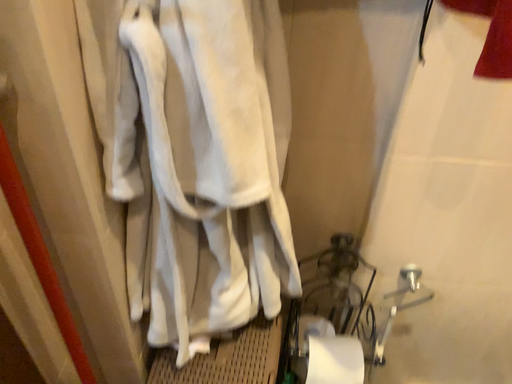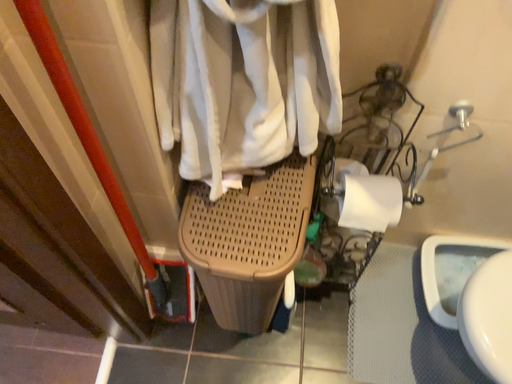
Question: Which way did the camera rotate in the video?

Choices:
 (A) rotated downward
 (B) rotated upward

Answer: (A)